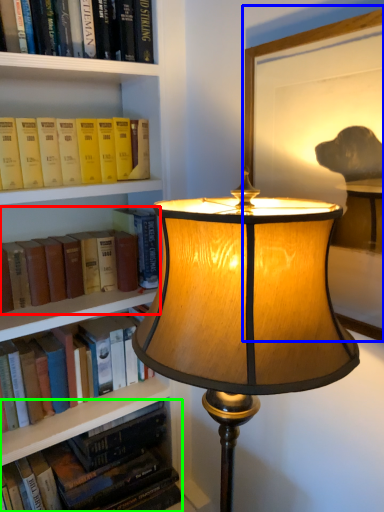
Question: Based on their relative distances, which object is farther from book (highlighted by a red box)? Choose from picture frame (highlighted by a blue box) and book (highlighted by a green box).

Choices:
 (A) picture frame
 (B) book

Answer: (A)